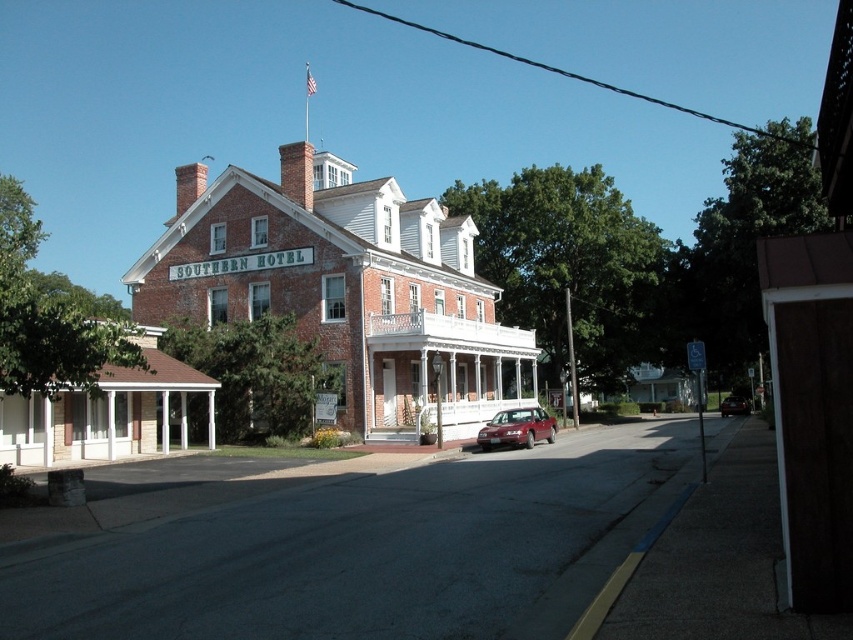
Question: Can you confirm if white wooden porch at center is positioned to the left of shiny maroon sedan at center?

Choices:
 (A) no
 (B) yes

Answer: (B)

Question: Which object is farther from the camera taking this photo?

Choices:
 (A) white wooden porch at center
 (B) shiny red sedan at center

Answer: (B)

Question: Does shiny maroon sedan at center have a larger size compared to shiny red sedan at center?

Choices:
 (A) no
 (B) yes

Answer: (A)

Question: Can you confirm if white wooden porch at center is positioned below shiny red sedan at center?

Choices:
 (A) no
 (B) yes

Answer: (A)

Question: Which object is farther from the camera taking this photo?

Choices:
 (A) shiny maroon sedan at center
 (B) white wooden porch at center

Answer: (B)

Question: Which of the following is the farthest from the observer?

Choices:
 (A) shiny maroon sedan at center
 (B) white wooden porch at center
 (C) shiny red sedan at center

Answer: (C)